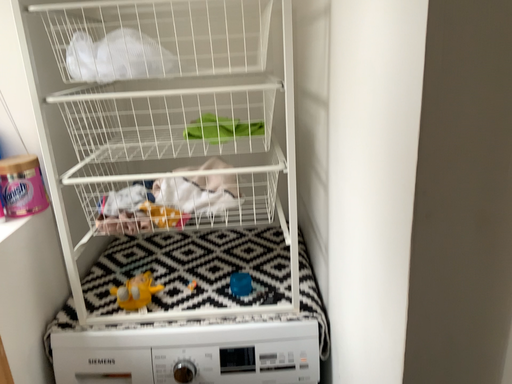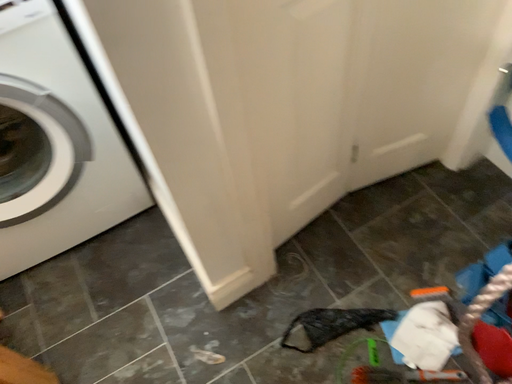
Question: How did the camera likely rotate when shooting the video?

Choices:
 (A) rotated upward
 (B) rotated downward

Answer: (B)